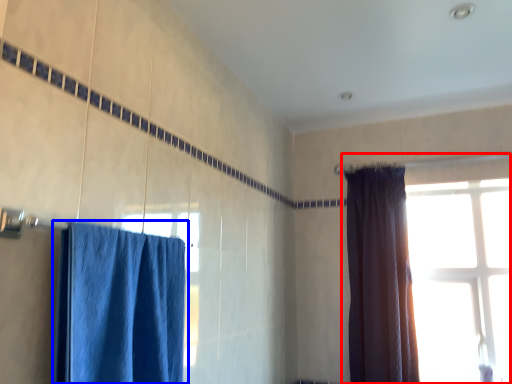
Question: Which object appears closest to the camera in this image, window (highlighted by a red box) or curtain (highlighted by a blue box)?

Choices:
 (A) window
 (B) curtain

Answer: (B)